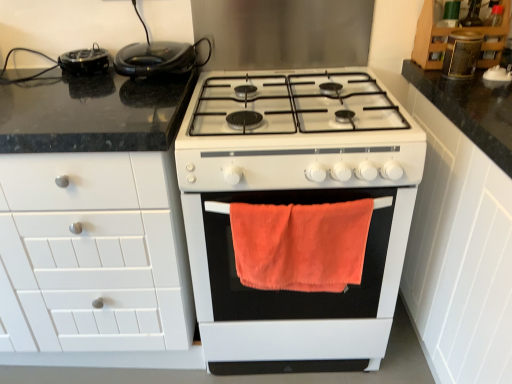
Consider the image. How much space does white matte cabinet at right, which ranks as the first cabinetry in right-to-left order, occupy vertically?

It is 37.16 inches.

Where is `white matte gas stove at center, placed as the second appliance when sorted from right to left`? white matte gas stove at center, placed as the second appliance when sorted from right to left is located at coordinates (295, 203).

What are the coordinates of `wooden cabinet at upper right, the second cabinetry viewed from the left` in the screenshot? It's located at [448, 35].

This screenshot has height=384, width=512. What do you see at coordinates (155, 59) in the screenshot?
I see `black rubberized toaster at upper left` at bounding box center [155, 59].

The height and width of the screenshot is (384, 512). Identify the location of matte brown jar at upper right, which ranks as the 1th appliance in right-to-left order. (462, 54).

Between wooden cabinet at upper right, acting as the second cabinetry starting from the right, and white matte cabinet at left, placed as the 1th cabinetry when sorted from left to right, which one has smaller size?

Smaller between the two is wooden cabinet at upper right, acting as the second cabinetry starting from the right.

From a real-world perspective, is wooden cabinet at upper right, acting as the second cabinetry starting from the right, beneath white matte cabinet at left, placed as the 1th cabinetry when sorted from left to right?

Incorrect, from a real-world perspective, wooden cabinet at upper right, acting as the second cabinetry starting from the right, is higher than white matte cabinet at left, placed as the 1th cabinetry when sorted from left to right.

Does wooden cabinet at upper right, acting as the second cabinetry starting from the right, have a lesser width compared to white matte cabinet at left, which is counted as the third cabinetry, starting from the right?

Yes.

Which object is positioned more to the left, white matte gas stove at center, placed as the second appliance when sorted from right to left, or white matte cabinet at right, the 3th cabinetry in the left-to-right sequence?

white matte gas stove at center, placed as the second appliance when sorted from right to left, is more to the left.

From a real-world perspective, is white matte gas stove at center, positioned as the third appliance in top-to-bottom order, beneath white matte cabinet at right, which ranks as the first cabinetry in right-to-left order?

Correct, in the physical world, white matte gas stove at center, positioned as the third appliance in top-to-bottom order, is lower than white matte cabinet at right, which ranks as the first cabinetry in right-to-left order.

Between white matte gas stove at center, the second appliance viewed from the left, and white matte cabinet at right, which ranks as the first cabinetry in right-to-left order, which one has more height?

Standing taller between the two is white matte cabinet at right, which ranks as the first cabinetry in right-to-left order.

Is white matte gas stove at center, positioned as the third appliance in top-to-bottom order, looking in the opposite direction of white matte cabinet at right, which ranks as the first cabinetry in right-to-left order?

No, white matte gas stove at center, positioned as the third appliance in top-to-bottom order,'s orientation is not away from white matte cabinet at right, which ranks as the first cabinetry in right-to-left order.

From the image's perspective, starting from the wooden cabinet at upper right, the second cabinetry viewed from the left, which appliance is the 2nd one below? Please provide its 2D coordinates.

[(462, 54)]

Can you confirm if matte brown jar at upper right, which ranks as the 1th appliance in right-to-left order, is wider than wooden cabinet at upper right, acting as the second cabinetry starting from the right?

No, matte brown jar at upper right, which ranks as the 1th appliance in right-to-left order, is not wider than wooden cabinet at upper right, acting as the second cabinetry starting from the right.

Looking at this image, which of these two, matte brown jar at upper right, positioned as the second appliance in top-to-bottom order, or wooden cabinet at upper right, the second cabinetry viewed from the left, is bigger?

wooden cabinet at upper right, the second cabinetry viewed from the left, is bigger.

Does matte brown jar at upper right, which is the 2th appliance from bottom to top, come behind wooden cabinet at upper right, acting as the second cabinetry starting from the right?

No, matte brown jar at upper right, which is the 2th appliance from bottom to top, is in front of wooden cabinet at upper right, acting as the second cabinetry starting from the right.

Is black glossy waffle maker at upper left, which appears as the 1th appliance when viewed from the left, closer to the viewer compared to white matte cabinet at right, which ranks as the first cabinetry in right-to-left order?

No, it is not.

Looking at this image, considering the relative sizes of black glossy waffle maker at upper left, which appears as the 1th appliance when viewed from the left, and white matte cabinet at right, the 3th cabinetry in the left-to-right sequence, in the image provided, is black glossy waffle maker at upper left, which appears as the 1th appliance when viewed from the left, shorter than white matte cabinet at right, the 3th cabinetry in the left-to-right sequence,?

Yes.

From a real-world perspective, is black glossy waffle maker at upper left, the 1th appliance when ordered from top to bottom, over white matte cabinet at right, which ranks as the first cabinetry in right-to-left order?

Yes.

Where is `appliance that is the 3rd object located behind the white matte cabinet at left, which is counted as the third cabinetry, starting from the right`? This screenshot has height=384, width=512. appliance that is the 3rd object located behind the white matte cabinet at left, which is counted as the third cabinetry, starting from the right is located at coordinates (85, 60).

Is black glossy waffle maker at upper left, which appears as the 1th appliance when viewed from the left, looking in the opposite direction of white matte cabinet at left, placed as the 1th cabinetry when sorted from left to right?

black glossy waffle maker at upper left, which appears as the 1th appliance when viewed from the left, does not have its back to white matte cabinet at left, placed as the 1th cabinetry when sorted from left to right.

In the scene shown: Considering the relative positions of black glossy waffle maker at upper left, the third appliance when ordered from right to left, and white matte cabinet at left, which is counted as the third cabinetry, starting from the right, in the image provided, is black glossy waffle maker at upper left, the third appliance when ordered from right to left, to the right of white matte cabinet at left, which is counted as the third cabinetry, starting from the right, from the viewer's perspective?

Correct, you'll find black glossy waffle maker at upper left, the third appliance when ordered from right to left, to the right of white matte cabinet at left, which is counted as the third cabinetry, starting from the right.

From a real-world perspective, which object stands above the other?

matte brown jar at upper right, positioned as the second appliance in top-to-bottom order.

Is matte brown jar at upper right, positioned as the second appliance in top-to-bottom order, positioned with its back to white matte gas stove at center, positioned as the third appliance in top-to-bottom order?

No.

Based on their positions, is matte brown jar at upper right, the third appliance from the left, located to the left or right of white matte gas stove at center, positioned as the third appliance in top-to-bottom order?

In the image, matte brown jar at upper right, the third appliance from the left, appears on the right side of white matte gas stove at center, positioned as the third appliance in top-to-bottom order.

Is black rubberized toaster at upper left to the left or to the right of white matte gas stove at center, positioned as the third appliance in top-to-bottom order, in the image?

From the image, it's evident that black rubberized toaster at upper left is to the left of white matte gas stove at center, positioned as the third appliance in top-to-bottom order.

Between black rubberized toaster at upper left and white matte gas stove at center, which ranks as the first appliance in bottom-to-top order, which one has smaller width?

black rubberized toaster at upper left is thinner.

From a real-world perspective, is black rubberized toaster at upper left physically located above or below white matte gas stove at center, the second appliance viewed from the left?

black rubberized toaster at upper left is above white matte gas stove at center, the second appliance viewed from the left.

Image resolution: width=512 pixels, height=384 pixels. In order to click on cabinetry that is the 1st object to the right of the white matte cabinet at left, placed as the 1th cabinetry when sorted from left to right, starting at the anchor in this screenshot , I will do `click(448, 35)`.

There is a white matte gas stove at center, which ranks as the first appliance in bottom-to-top order. Identify the location of the 1st cabinetry above it (from the image's perspective). (459, 254).

Looking at the image, which one is located closer to wooden cabinet at upper right, the second cabinetry viewed from the left, white matte cabinet at right, which ranks as the first cabinetry in right-to-left order, or orange fuzzy towel at center?

Based on the image, white matte cabinet at right, which ranks as the first cabinetry in right-to-left order, appears to be nearer to wooden cabinet at upper right, the second cabinetry viewed from the left.

Which object lies further to the anchor point white matte gas stove at center, placed as the second appliance when sorted from right to left, matte brown jar at upper right, which ranks as the 1th appliance in right-to-left order, or white matte cabinet at right, which ranks as the first cabinetry in right-to-left order?

Based on the image, matte brown jar at upper right, which ranks as the 1th appliance in right-to-left order, appears to be further to white matte gas stove at center, placed as the second appliance when sorted from right to left.

Looking at the image, which one is located closer to wooden cabinet at upper right, acting as the second cabinetry starting from the right, white matte gas stove at center, the second appliance viewed from the left, or orange fuzzy towel at center?

white matte gas stove at center, the second appliance viewed from the left.

Estimate the real-world distances between objects in this image. Which object is further from black glossy waffle maker at upper left, the 1th appliance when ordered from top to bottom, black rubberized toaster at upper left or matte brown jar at upper right, which is the 2th appliance from bottom to top?

matte brown jar at upper right, which is the 2th appliance from bottom to top, is positioned further to the anchor black glossy waffle maker at upper left, the 1th appliance when ordered from top to bottom.

Based on their spatial positions, is white matte gas stove at center, which ranks as the first appliance in bottom-to-top order, or black rubberized toaster at upper left closer to wooden cabinet at upper right, acting as the second cabinetry starting from the right?

The object closer to wooden cabinet at upper right, acting as the second cabinetry starting from the right, is white matte gas stove at center, which ranks as the first appliance in bottom-to-top order.

Which object lies further to the anchor point black rubberized toaster at upper left, white matte cabinet at right, the 3th cabinetry in the left-to-right sequence, or orange fuzzy towel at center?

The object further to black rubberized toaster at upper left is white matte cabinet at right, the 3th cabinetry in the left-to-right sequence.

From the image, which object appears to be farther from white matte cabinet at left, placed as the 1th cabinetry when sorted from left to right, white matte gas stove at center, placed as the second appliance when sorted from right to left, or black glossy waffle maker at upper left, the third appliance when ordered from right to left?

black glossy waffle maker at upper left, the third appliance when ordered from right to left.

Which object lies further to the anchor point black glossy waffle maker at upper left, the third appliance from the bottom, white matte gas stove at center, positioned as the third appliance in top-to-bottom order, or black rubberized toaster at upper left?

The object further to black glossy waffle maker at upper left, the third appliance from the bottom, is white matte gas stove at center, positioned as the third appliance in top-to-bottom order.

The width and height of the screenshot is (512, 384). Find the location of `oven located between black rubberized toaster at upper left and matte brown jar at upper right, which is the 2th appliance from bottom to top, in the left-right direction`. oven located between black rubberized toaster at upper left and matte brown jar at upper right, which is the 2th appliance from bottom to top, in the left-right direction is located at coordinates (293, 291).

Locate an element on the screen. The width and height of the screenshot is (512, 384). kitchen appliance between black glossy waffle maker at upper left, which appears as the 1th appliance when viewed from the left, and wooden cabinet at upper right, the second cabinetry viewed from the left, from left to right is located at coordinates (155, 59).

Find the location of `oven between white matte cabinet at left, which is counted as the third cabinetry, starting from the right, and matte brown jar at upper right, which ranks as the 1th appliance in right-to-left order, in the horizontal direction`. oven between white matte cabinet at left, which is counted as the third cabinetry, starting from the right, and matte brown jar at upper right, which ranks as the 1th appliance in right-to-left order, in the horizontal direction is located at coordinates (293, 291).

This screenshot has height=384, width=512. In order to click on kitchen appliance located between black glossy waffle maker at upper left, which appears as the 1th appliance when viewed from the left, and matte brown jar at upper right, which is the 2th appliance from bottom to top, in the left-right direction in this screenshot , I will do `click(155, 59)`.